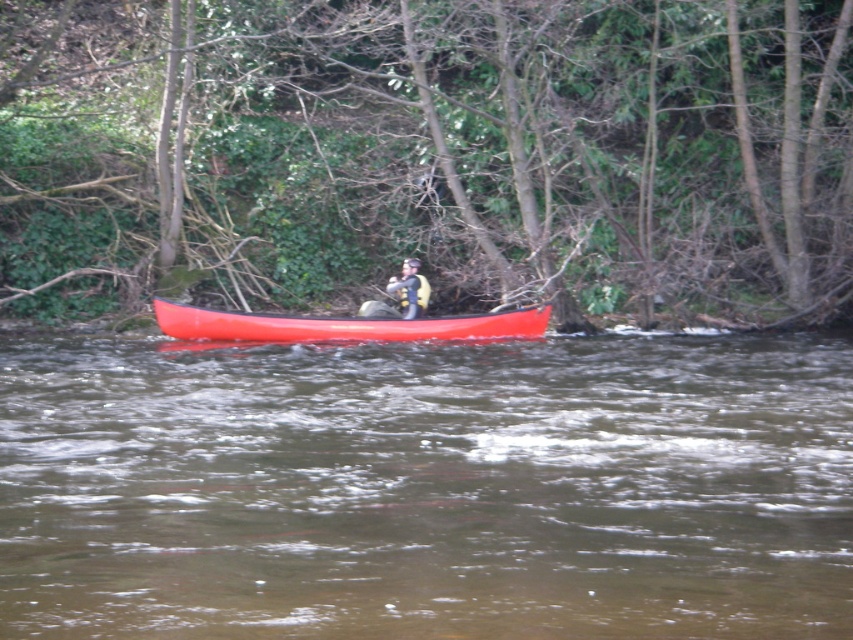
You are a photographer trying to capture a clear shot of the matte yellow life vest at center while also including the green leafy tree at center in the frame. Since both are at the center, which object will appear larger in your photo?

The green leafy tree at center is bigger than the matte yellow life vest at center, so it will appear larger in the photo.

You are a photographer positioned on the riverbank and want to capture a clear photo of the matte red canoe at center without any obstructions from the green leafy tree at center. Based on their positions, is this possible?

The green leafy tree at center is further to the viewer than the matte red canoe at center, so the tree is closer to you. This means the tree would block the view of the canoe, making it impossible to take a clear photo of the matte red canoe at center without the obstruction.